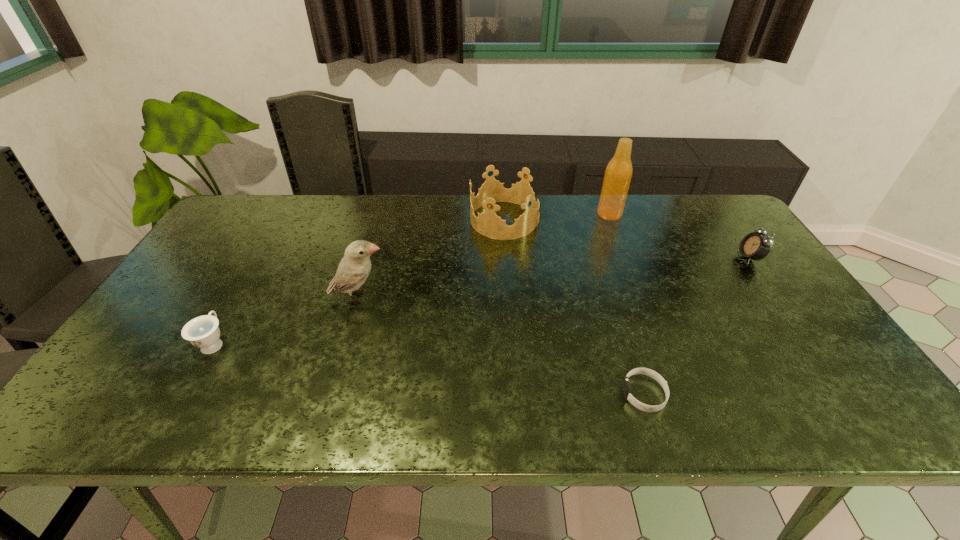
The height and width of the screenshot is (540, 960). I want to click on the shortest object, so click(x=626, y=388).

Find the location of a particular element. vacant space situated 0.360m on the left of the tallest object is located at coordinates (489, 214).

Identify the location of vacant space located at the face of the second object from left to right. (416, 298).

Where is `vacant space located 0.100m on the front-facing side of the tiara`? This screenshot has width=960, height=540. vacant space located 0.100m on the front-facing side of the tiara is located at coordinates (440, 220).

The width and height of the screenshot is (960, 540). I want to click on free point located on the front-facing side of the tiara, so pyautogui.click(x=367, y=220).

Locate an element on the screen. vacant space situated on the front-facing side of the tiara is located at coordinates (392, 220).

Locate an element on the screen. The image size is (960, 540). free space located 0.240m on the face of the alarm clock is located at coordinates (658, 258).

Where is `vacant space located on the face of the alarm clock`? vacant space located on the face of the alarm clock is located at coordinates coord(634,258).

Find the location of `free region located on the face of the alarm clock`. free region located on the face of the alarm clock is located at coordinates (718, 258).

Identify the location of vacant space located on the side of the teacup with the handle. This screenshot has height=540, width=960. (264, 256).